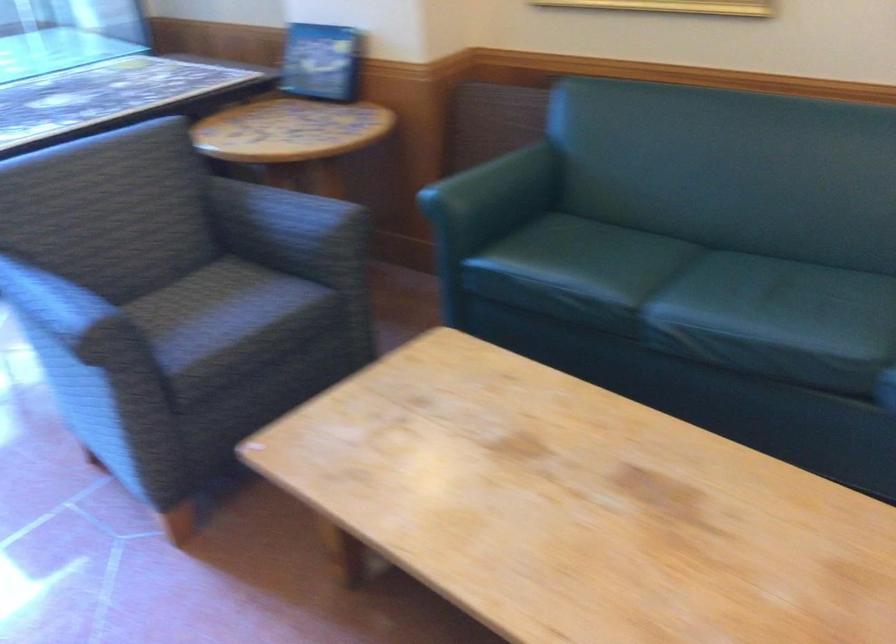
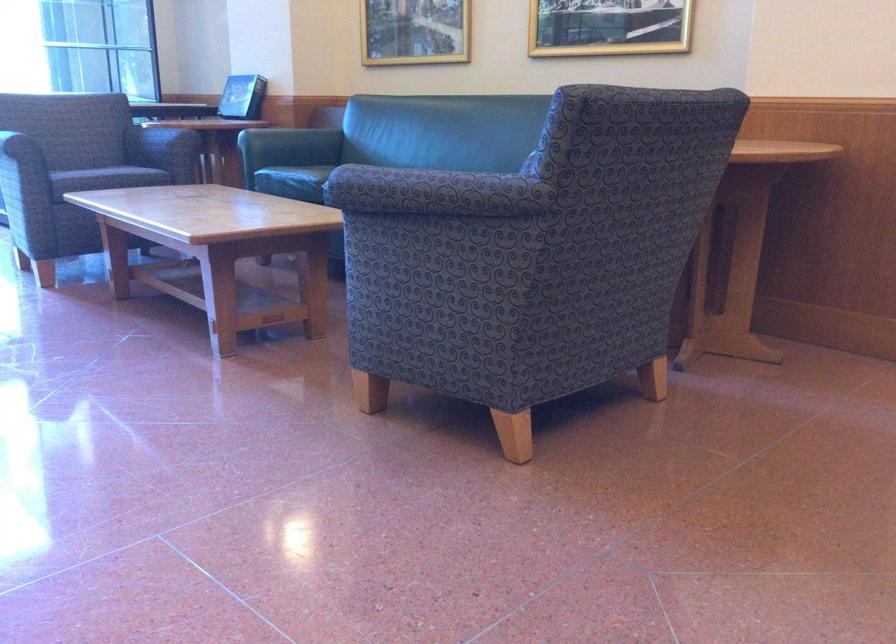
Question: I am providing you with two images of the same scene from different viewpoints. Please identify which objects are invisible in image2.

Choices:
 (A) sofa sitting surface
 (B) faucet diverter switch
 (C) chair sitting surface
 (D) patterned chair armrest

Answer: (C)